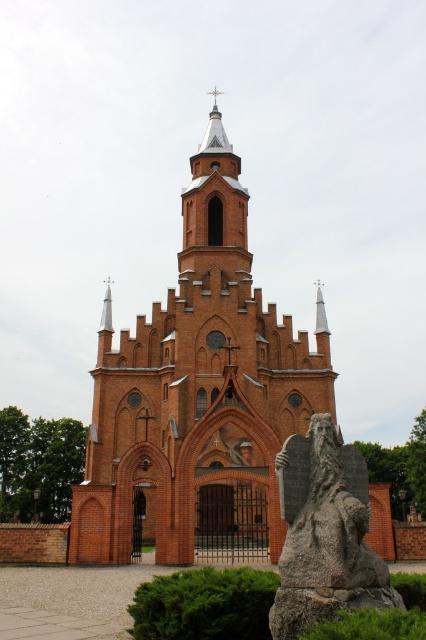
Question: Can you confirm if red brick church tower at center is wider than gray stone statue at lower right?

Choices:
 (A) no
 (B) yes

Answer: (B)

Question: Which of the following is the farthest from the observer?

Choices:
 (A) red brick church tower at center
 (B) gray stone statue at lower right

Answer: (A)

Question: Which of the following is the farthest from the observer?

Choices:
 (A) (293, 346)
 (B) (368, 570)

Answer: (A)

Question: Is red brick church tower at center wider than gray stone statue at lower right?

Choices:
 (A) no
 (B) yes

Answer: (B)

Question: Which object is farther from the camera taking this photo?

Choices:
 (A) red brick church tower at center
 (B) gray stone statue at lower right

Answer: (A)

Question: Can you confirm if red brick church tower at center is positioned to the left of gray stone statue at lower right?

Choices:
 (A) yes
 (B) no

Answer: (A)